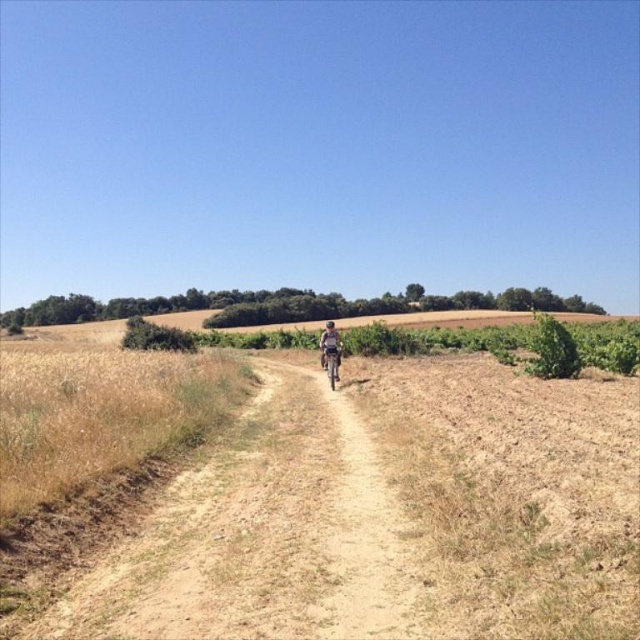
Question: Which of the following is the closest to the observer?

Choices:
 (A) (337, 378)
 (B) (324, 353)

Answer: (A)

Question: Is camouflage fabric cyclist at center further to camera compared to metallic silver bicycle at center?

Choices:
 (A) no
 (B) yes

Answer: (B)

Question: Does camouflage fabric cyclist at center have a larger size compared to metallic silver bicycle at center?

Choices:
 (A) yes
 (B) no

Answer: (A)

Question: Is camouflage fabric cyclist at center above metallic silver bicycle at center?

Choices:
 (A) no
 (B) yes

Answer: (B)

Question: Which object appears farthest from the camera in this image?

Choices:
 (A) metallic silver bicycle at center
 (B) camouflage fabric cyclist at center

Answer: (B)